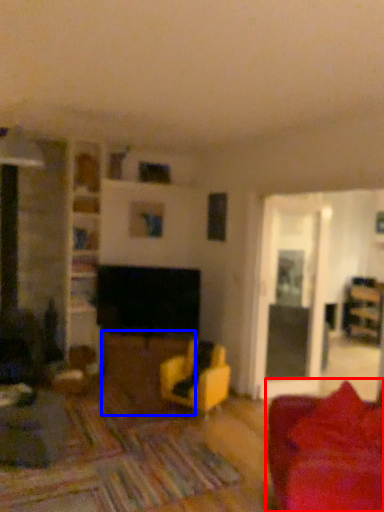
Question: Which object appears closest to the camera in this image, studio couch (highlighted by a red box) or table (highlighted by a blue box)?

Choices:
 (A) studio couch
 (B) table

Answer: (A)